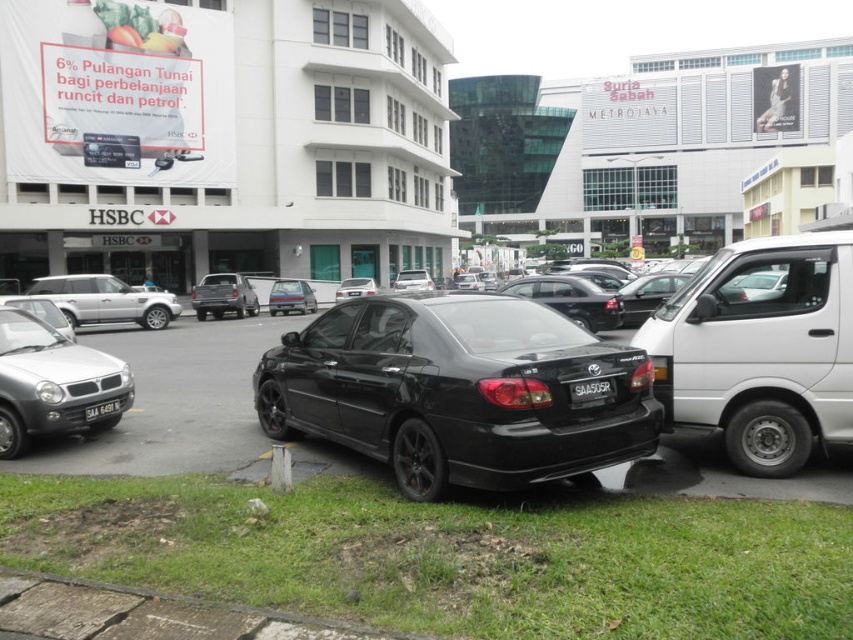
Question: Is silver metallic hatchback at left above black matte sedan at center?

Choices:
 (A) no
 (B) yes

Answer: (A)

Question: Is silver metallic hatchback at left above black plastic license plate at center?

Choices:
 (A) no
 (B) yes

Answer: (A)

Question: Which object is positioned closest to the black plastic license plate at lower center?

Choices:
 (A) silver metallic suv at left
 (B) black matte sedan at center
 (C) silver metallic hatchback at left

Answer: (C)

Question: Based on their relative distances, which object is farther from the black matte sedan at center?

Choices:
 (A) glossy black car at center
 (B) satin black sedan at center
 (C) black plastic license plate at lower center
 (D) metallic silver sedan at center

Answer: (B)

Question: Which point is farther from the camera taking this photo?

Choices:
 (A) (820, 372)
 (B) (364, 292)
 (C) (57, 355)
 (D) (294, 416)

Answer: (B)

Question: Is satin black sedan at center to the left of black plastic license plate at lower center from the viewer's perspective?

Choices:
 (A) yes
 (B) no

Answer: (B)